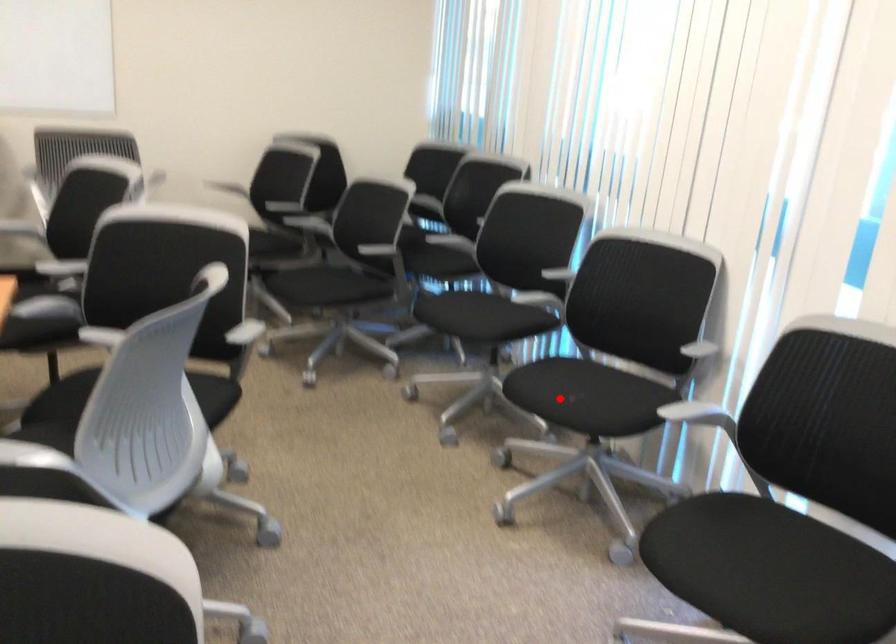
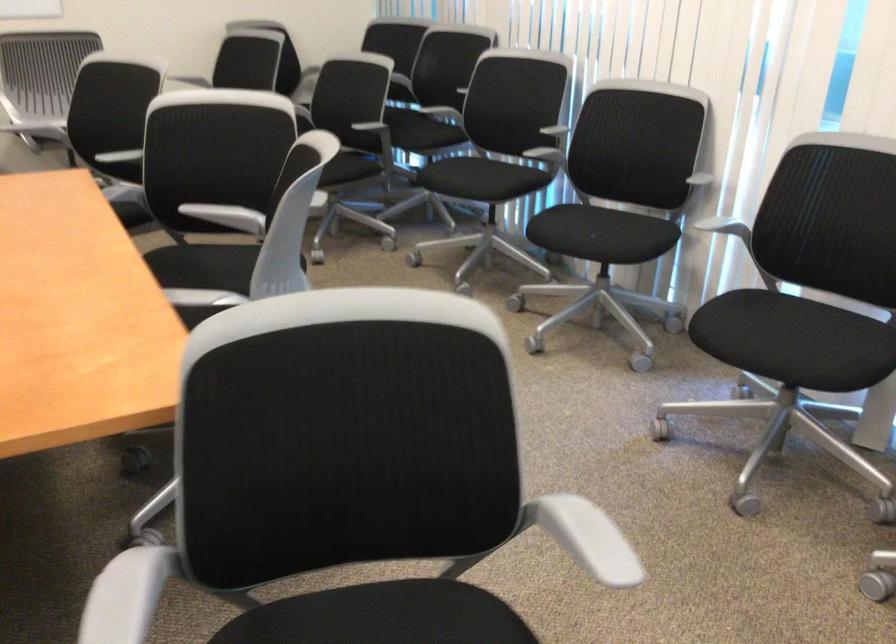
Question: A red point is marked in image1. In image2, is the corresponding 3D point closer to the camera or farther? Reply with the corresponding letter.

Choices:
 (A) The corresponding 3D point is closer.
 (B) The corresponding 3D point is farther.

Answer: (B)